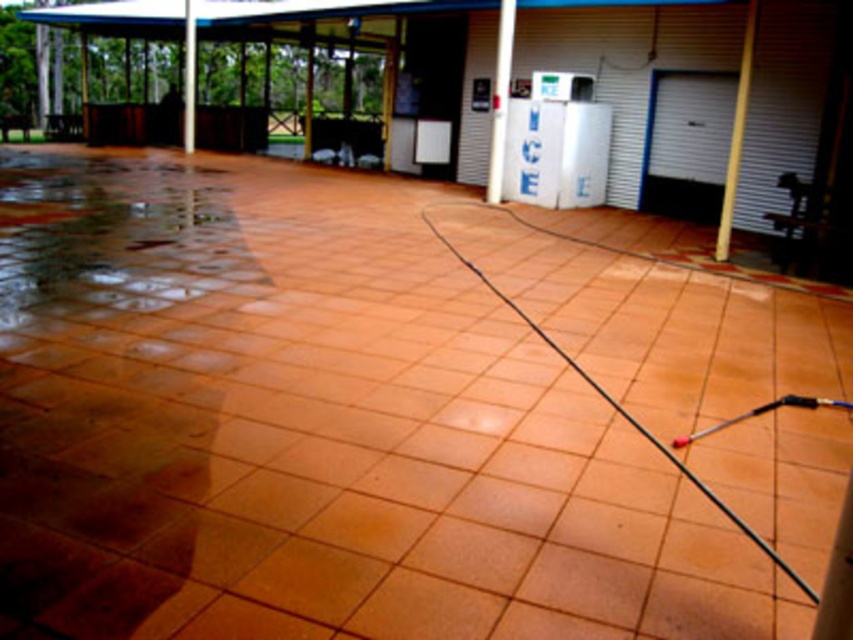
You need to park a car that is 2 meters wide. Can the smooth concrete garage at center accommodate it? Please consider the width of the wooden pole at right as well.

The smooth concrete garage at center might be wider than the wooden pole at right, so it could potentially accommodate a 2 meter wide car. However, the exact width is uncertain based on the given information.

You are standing at the origin point of the coordinate system where the bottom left corner of the image is the origin. The image has a coordinate system where the x and y axes increase to the right and up respectively. You need to move to the wooden pole at right. In which direction should you move first? Please answer with either left, right, up, or down.

The wooden pole at right is located at coordinate point (735, 132). Since the origin is at the bottom left corner, moving right increases the x coordinate and moving up increases the y coordinate. To reach the wooden pole at right, you should first move right to increase your x coordinate from 0 to 0.209, then move up to reach the y coordinate of 0.864. However, the question asks for the first direction to move. Since the pole is at x 0.209, which is to the right of the origin, the first direction should

You are a painter who needs to choose between two poles to hang a banner. The banner requires a pole wider than 10 cm. You have the wooden pole at right and the white glossy pole at upper center. Which pole should you choose?

The white glossy pole at upper center has a greater width than the wooden pole at right, so you should choose the white glossy pole at upper center to hang the banner since it meets the width requirement of over 10 cm.